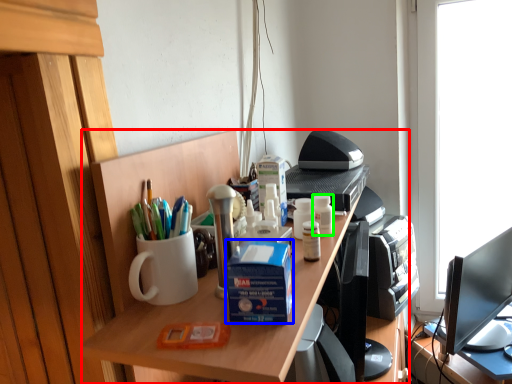
Question: Which is nearer to the desk (highlighted by a red box)? box (highlighted by a blue box) or stationery (highlighted by a green box).

Choices:
 (A) box
 (B) stationery

Answer: (A)